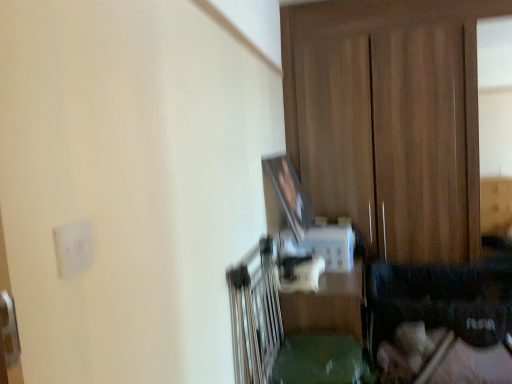
Question: From the image's perspective, is white matte electric outlet at upper left above wooden dresser at center?

Choices:
 (A) no
 (B) yes

Answer: (A)

Question: From the image's perspective, is white matte electric outlet at upper left under wooden dresser at center?

Choices:
 (A) no
 (B) yes

Answer: (B)

Question: Is the position of white matte electric outlet at upper left less distant than that of wooden dresser at center?

Choices:
 (A) no
 (B) yes

Answer: (B)

Question: Is the depth of white matte electric outlet at upper left greater than that of wooden dresser at center?

Choices:
 (A) no
 (B) yes

Answer: (A)

Question: Is white matte electric outlet at upper left far from wooden dresser at center?

Choices:
 (A) yes
 (B) no

Answer: (A)

Question: In terms of height, does wooden dresser at center look taller or shorter compared to white matte electric outlet at upper left?

Choices:
 (A) short
 (B) tall

Answer: (B)

Question: Is wooden dresser at center in front of or behind white matte electric outlet at upper left in the image?

Choices:
 (A) front
 (B) behind

Answer: (B)

Question: From the image's perspective, is wooden dresser at center located above or below white matte electric outlet at upper left?

Choices:
 (A) above
 (B) below

Answer: (A)

Question: Would you say wooden dresser at center is inside or outside white matte electric outlet at upper left?

Choices:
 (A) outside
 (B) inside

Answer: (A)

Question: In the image, is white matte electric outlet at upper left positioned in front of or behind wooden dresser at center?

Choices:
 (A) behind
 (B) front

Answer: (B)

Question: Which is correct: white matte electric outlet at upper left is inside wooden dresser at center, or outside of it?

Choices:
 (A) outside
 (B) inside

Answer: (A)

Question: Is point pos(66,241) positioned closer to the camera than point pos(312,183)?

Choices:
 (A) closer
 (B) farther

Answer: (A)

Question: From the image's perspective, relative to wooden dresser at center, is white matte electric outlet at upper left above or below?

Choices:
 (A) below
 (B) above

Answer: (A)

Question: From the image's perspective, is wooden dresser at center located above or below green plastic table at center?

Choices:
 (A) above
 (B) below

Answer: (A)

Question: From a real-world perspective, is wooden dresser at center above or below green plastic table at center?

Choices:
 (A) below
 (B) above

Answer: (B)